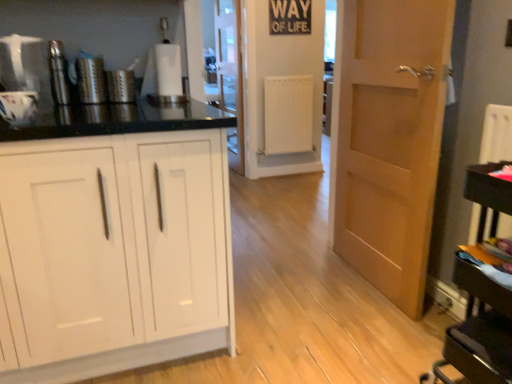
Question: Considering the relative sizes of white matte cabinet at left and metallic silver thermos at left, the third appliance positioned from the back, in the image provided, is white matte cabinet at left taller than metallic silver thermos at left, the third appliance positioned from the back,?

Choices:
 (A) yes
 (B) no

Answer: (A)

Question: Is white matte cabinet at left at the left side of metallic silver thermos at left, which appears as the second appliance when viewed from the front?

Choices:
 (A) yes
 (B) no

Answer: (B)

Question: Is white matte cabinet at left behind metallic silver thermos at left, the third appliance positioned from the back?

Choices:
 (A) no
 (B) yes

Answer: (A)

Question: From the image's perspective, is white matte cabinet at left beneath metallic silver thermos at left, which appears as the second appliance when viewed from the front?

Choices:
 (A) yes
 (B) no

Answer: (A)

Question: From a real-world perspective, is white matte cabinet at left below metallic silver thermos at left, which appears as the second appliance when viewed from the front?

Choices:
 (A) yes
 (B) no

Answer: (A)

Question: From the image's perspective, is white matte cabinet at left positioned above or below light brown wood door at right?

Choices:
 (A) below
 (B) above

Answer: (A)

Question: From their relative heights in the image, would you say white matte cabinet at left is taller or shorter than light brown wood door at right?

Choices:
 (A) short
 (B) tall

Answer: (A)

Question: Considering their positions, is white matte cabinet at left located in front of or behind light brown wood door at right?

Choices:
 (A) front
 (B) behind

Answer: (A)

Question: Looking at the image, does white matte cabinet at left seem bigger or smaller compared to light brown wood door at right?

Choices:
 (A) big
 (B) small

Answer: (A)

Question: From a real-world perspective, is white matte cabinet at left positioned above or below metallic grater at left, marked as the 1th appliance in a back-to-front arrangement?

Choices:
 (A) below
 (B) above

Answer: (A)

Question: In terms of size, does white matte cabinet at left appear bigger or smaller than metallic grater at left, arranged as the fourth appliance when viewed from the front?

Choices:
 (A) big
 (B) small

Answer: (A)

Question: Relative to metallic grater at left, arranged as the fourth appliance when viewed from the front, is white matte cabinet at left in front or behind?

Choices:
 (A) behind
 (B) front

Answer: (B)

Question: Is white matte cabinet at left to the left or to the right of metallic grater at left, arranged as the fourth appliance when viewed from the front, in the image?

Choices:
 (A) left
 (B) right

Answer: (A)

Question: Considering their positions, is metallic silver thermos at left, which appears as the second appliance when viewed from the front, located in front of or behind clear glass screen door at center?

Choices:
 (A) front
 (B) behind

Answer: (A)

Question: From their relative heights in the image, would you say metallic silver thermos at left, which appears as the second appliance when viewed from the front, is taller or shorter than clear glass screen door at center?

Choices:
 (A) tall
 (B) short

Answer: (B)